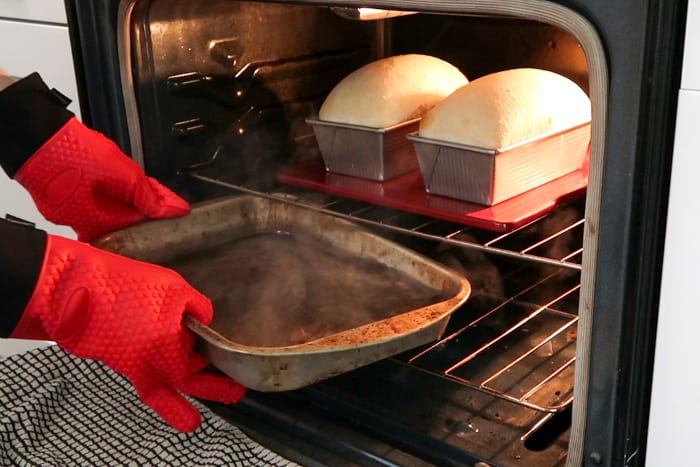
The height and width of the screenshot is (467, 700). I want to click on tray, so click(365, 164).